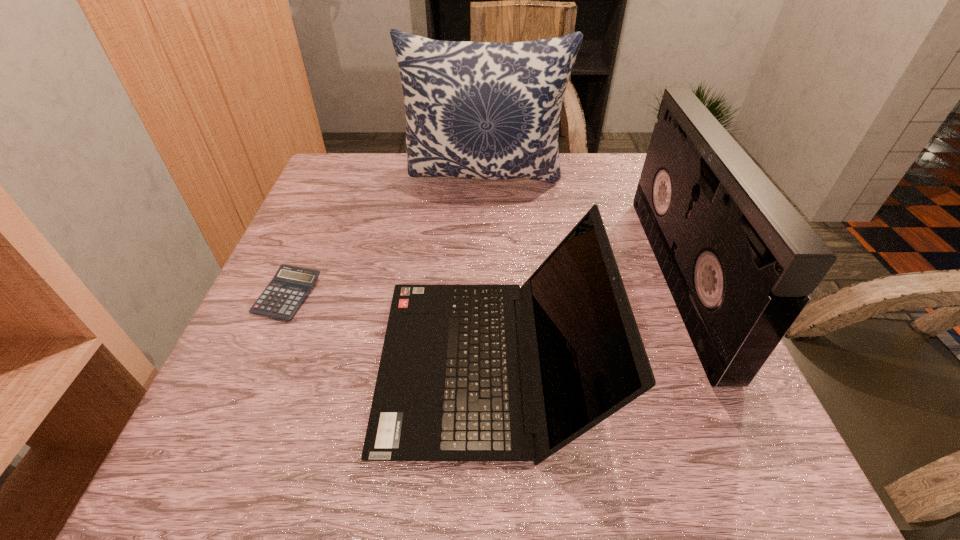
In order to click on the tallest object in this screenshot , I will do `click(480, 110)`.

At what (x,y) coordinates should I click in order to perform the action: click on cushion. Please return your answer as a coordinate pair (x, y). Looking at the image, I should click on (480, 110).

Locate an element on the screen. This screenshot has width=960, height=540. the rightmost object is located at coordinates (739, 260).

Where is `the third shortest object`? the third shortest object is located at coordinates (739, 260).

Where is `the third tallest object`? the third tallest object is located at coordinates (448, 389).

Find the location of `the leftmost object`. the leftmost object is located at coordinates (290, 286).

This screenshot has width=960, height=540. In order to click on calculator in this screenshot , I will do `click(290, 286)`.

The width and height of the screenshot is (960, 540). I want to click on blank area located on the front surface of the tallest object, so click(487, 294).

Locate an element on the screen. Image resolution: width=960 pixels, height=540 pixels. blank area located on the front side of the second tallest object is located at coordinates (575, 278).

Find the location of a particular element. This screenshot has height=540, width=960. vacant region located on the front side of the second tallest object is located at coordinates (530, 278).